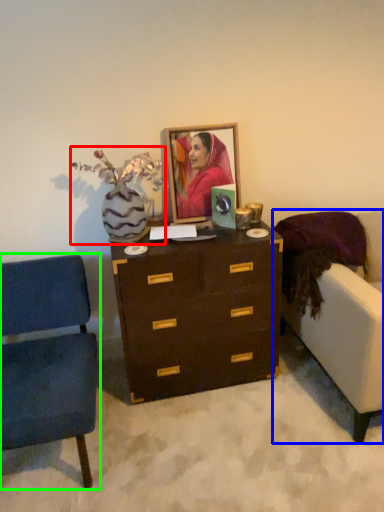
Question: Which is farther away from floral arrangement (highlighted by a red box)? studio couch (highlighted by a blue box) or chair (highlighted by a green box)?

Choices:
 (A) studio couch
 (B) chair

Answer: (A)